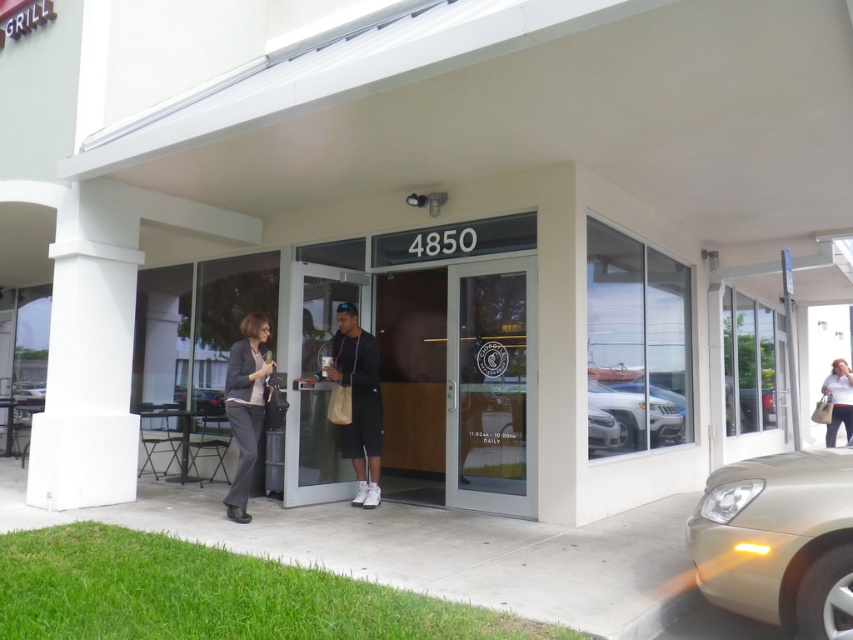
You are standing in front of the building and want to determine which of the two points, point (709, 586) or point (337, 330), is closer to you. Based on the image, which point is nearer?

Point (709, 586) is closer to the viewer than point (337, 330).

Based on the photo, you are a delivery person trying to reach the entrance of the building at 4850. You see the clear glass door at center and the white matte car at center. Which one should you approach first to reach the entrance?

You should approach the clear glass door at center first because it is to the left of the white matte car at center, and the entrance is located at the center of the building.

You are a delivery person trying to enter the building at 4850. You see the white smooth column at left and the clear glass door at center. Which object should you approach to enter the building?

The clear glass door at center is the entrance, so you should approach the clear glass door at center to enter the building. The white smooth column at left is bigger but it is a column and not an entrance.